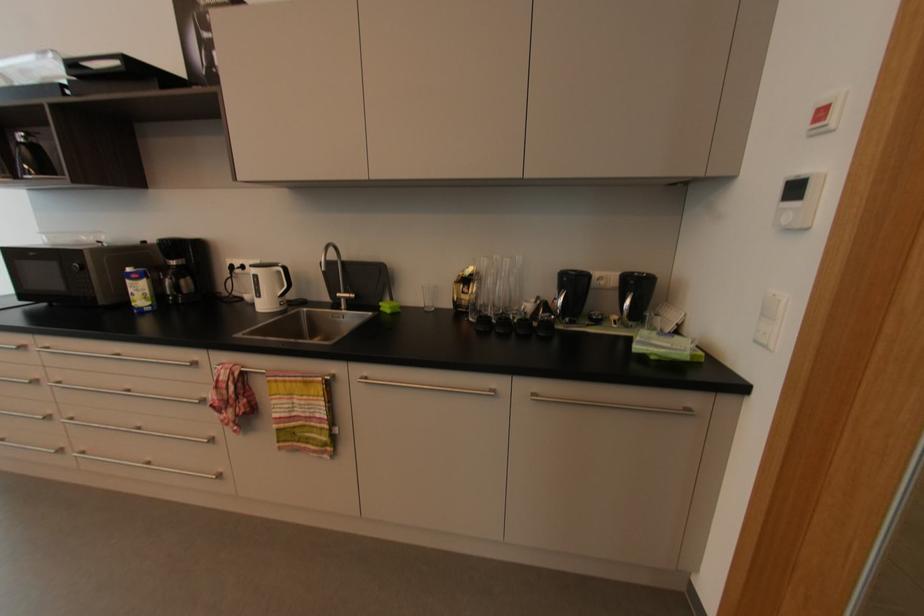
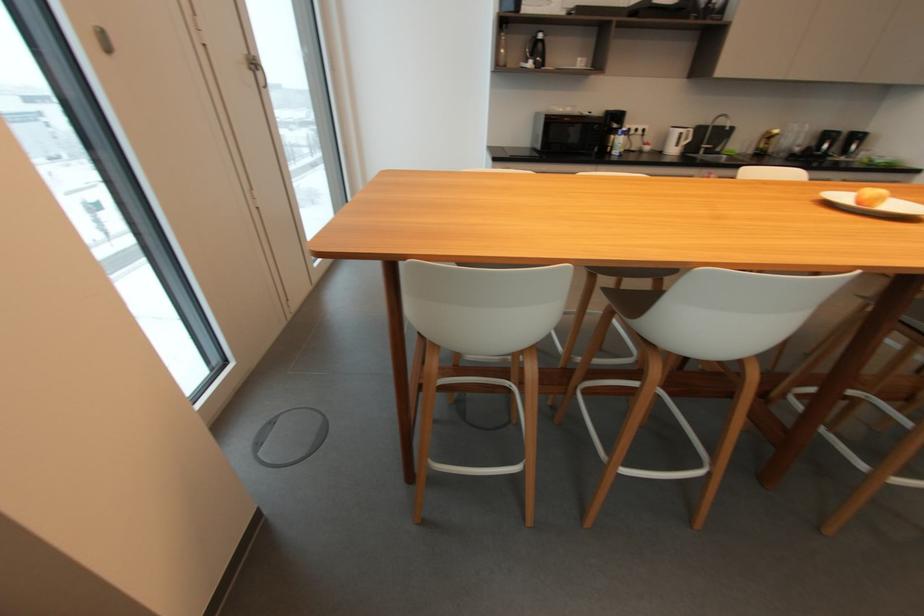
Which direction would the cameraman need to move to produce the second image?

The cameraman walked toward left, backward.